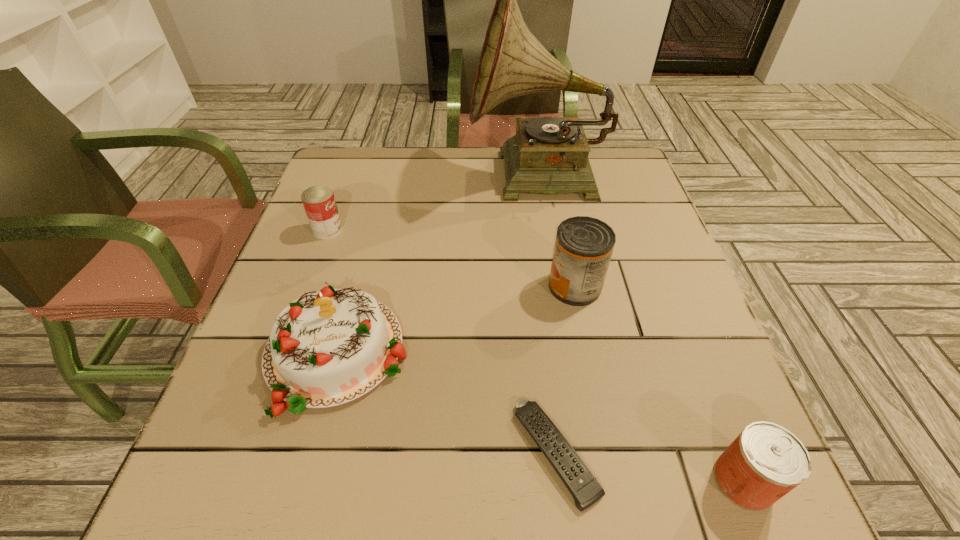
Identify the location of vacant region at the right edge of the desktop. (618, 276).

Locate an element on the screen. This screenshot has width=960, height=540. free space at the far left corner is located at coordinates (348, 161).

At what (x,y) coordinates should I click in order to perform the action: click on blank space at the near left corner of the desktop. Please return your answer as a coordinate pair (x, y). The image size is (960, 540). Looking at the image, I should click on (200, 456).

Identify the location of free space at the near right corner. (676, 490).

I want to click on free space that is in between the second can from right to left and the leftmost can, so click(x=451, y=258).

Where is `free space that is in between the remote control and the cake`? Image resolution: width=960 pixels, height=540 pixels. free space that is in between the remote control and the cake is located at coordinates (446, 403).

This screenshot has width=960, height=540. I want to click on vacant region between the record player and the shortest object, so click(x=547, y=315).

The image size is (960, 540). I want to click on vacant space in between the second can from left to right and the rightmost object, so click(x=660, y=383).

Find the location of `free space between the nearest can and the farthest object`. free space between the nearest can and the farthest object is located at coordinates (640, 329).

Find the location of a particular element. The image size is (960, 540). vacant area between the second nearest can and the farthest object is located at coordinates (556, 232).